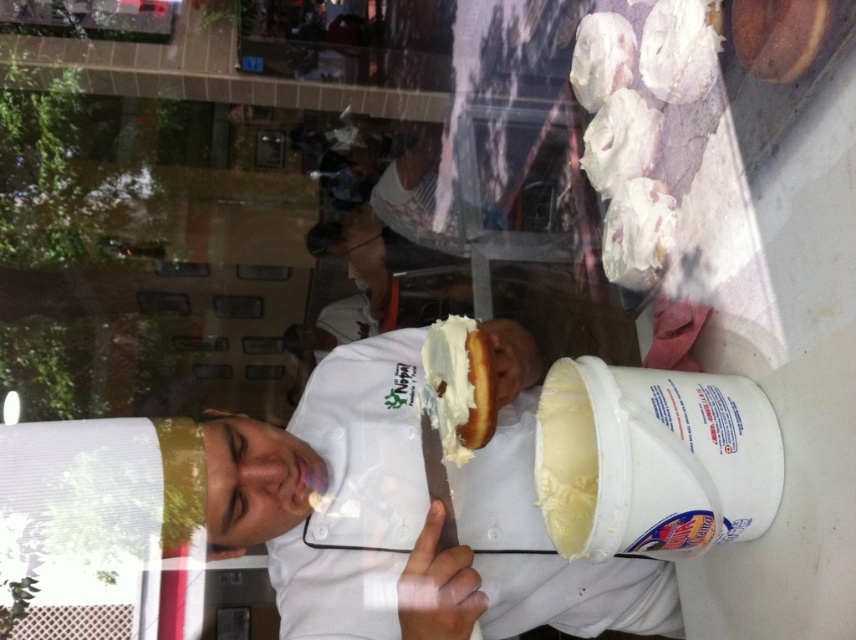
Does white fluffy pastry at upper right appear over white creamy pastry at upper right?

Correct, white fluffy pastry at upper right is located above white creamy pastry at upper right.

Does white fluffy pastry at upper right appear on the left side of white creamy pastry at upper right?

Incorrect, white fluffy pastry at upper right is not on the left side of white creamy pastry at upper right.

Find the location of `white fluffy pastry at upper right`. white fluffy pastry at upper right is located at coordinates (679, 49).

Measure the distance between point [479,371] and camera.

A distance of 33.29 inches exists between point [479,371] and camera.

Can you confirm if white creamy donut at center is positioned above white fluffy doughnut at upper center?

No.

Which is behind, point (446, 339) or point (574, 51)?

The point (574, 51) is more distant.

The height and width of the screenshot is (640, 856). Identify the location of white creamy donut at center. (461, 385).

Is white fluffy pastry at upper right thinner than white fluffy doughnut at upper center?

Correct, white fluffy pastry at upper right's width is less than white fluffy doughnut at upper center's.

Does point (657, 26) come closer to viewer compared to point (597, 99)?

Yes, it is.

Is point (687, 26) farther from camera compared to point (584, 84)?

No.

I want to click on white fluffy pastry at upper right, so click(x=679, y=49).